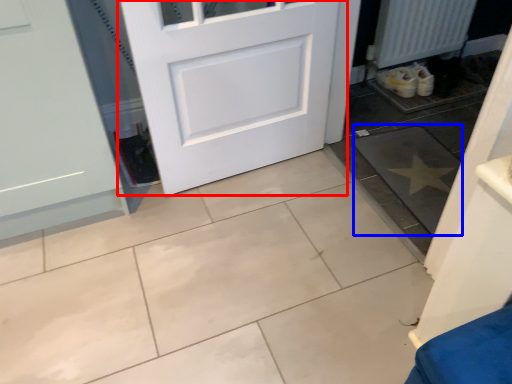
Question: Which object appears farthest to the camera in this image, door (highlighted by a red box) or ceramic tile (highlighted by a blue box)?

Choices:
 (A) door
 (B) ceramic tile

Answer: (B)